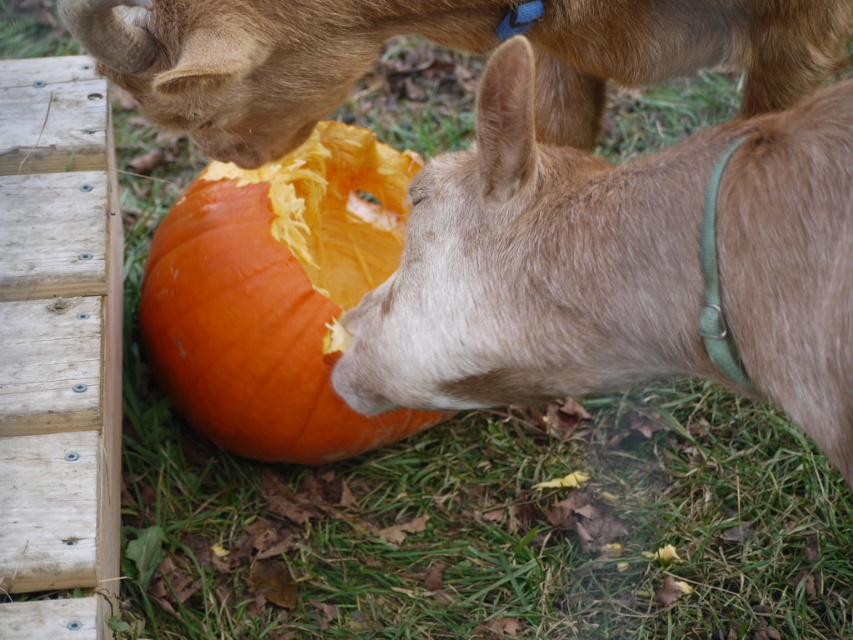
Between brown fuzzy goat at lower right and orange matte pumpkin at center, which one is positioned higher?

orange matte pumpkin at center

How distant is brown fuzzy goat at lower right from orange matte pumpkin at center?

They are 27.73 inches apart.

Is point (360, 321) positioned before point (322, 180)?

Yes, point (360, 321) is closer to viewer.

Locate an element on the screen. The height and width of the screenshot is (640, 853). brown fuzzy goat at lower right is located at coordinates (616, 266).

Who is taller, brown fuzzy goat at lower right or brown fur goat at upper center?

brown fuzzy goat at lower right is taller.

Is brown fuzzy goat at lower right smaller than brown fur goat at upper center?

Actually, brown fuzzy goat at lower right might be larger than brown fur goat at upper center.

Find the location of `brown fuzzy goat at lower right`. brown fuzzy goat at lower right is located at coordinates (616, 266).

Where is `brown fuzzy goat at lower right`? Image resolution: width=853 pixels, height=640 pixels. brown fuzzy goat at lower right is located at coordinates (616, 266).

I want to click on brown fur goat at upper center, so click(440, 44).

How far apart are brown fur goat at upper center and orange matte pumpkin at center?

brown fur goat at upper center is 59.75 centimeters away from orange matte pumpkin at center.

Describe the element at coordinates (440, 44) in the screenshot. Image resolution: width=853 pixels, height=640 pixels. I see `brown fur goat at upper center` at that location.

At what (x,y) coordinates should I click in order to perform the action: click on brown fur goat at upper center. Please return your answer as a coordinate pair (x, y). This screenshot has height=640, width=853. Looking at the image, I should click on (440, 44).